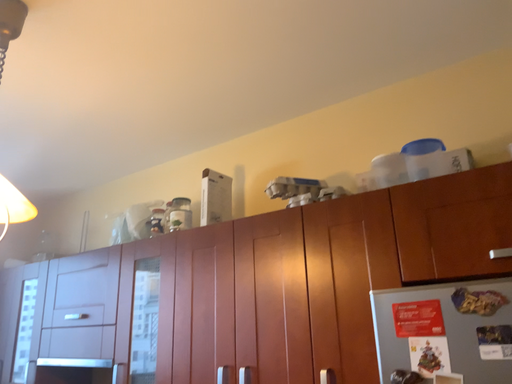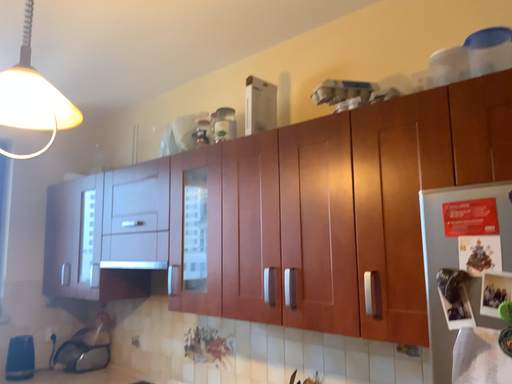
Question: How did the camera likely rotate when shooting the video?

Choices:
 (A) rotated downward
 (B) rotated upward

Answer: (A)